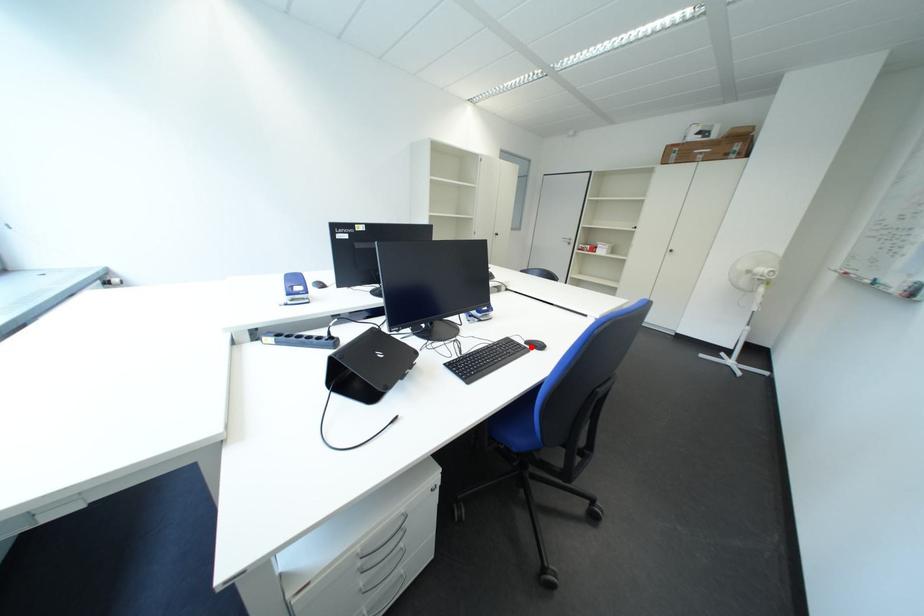
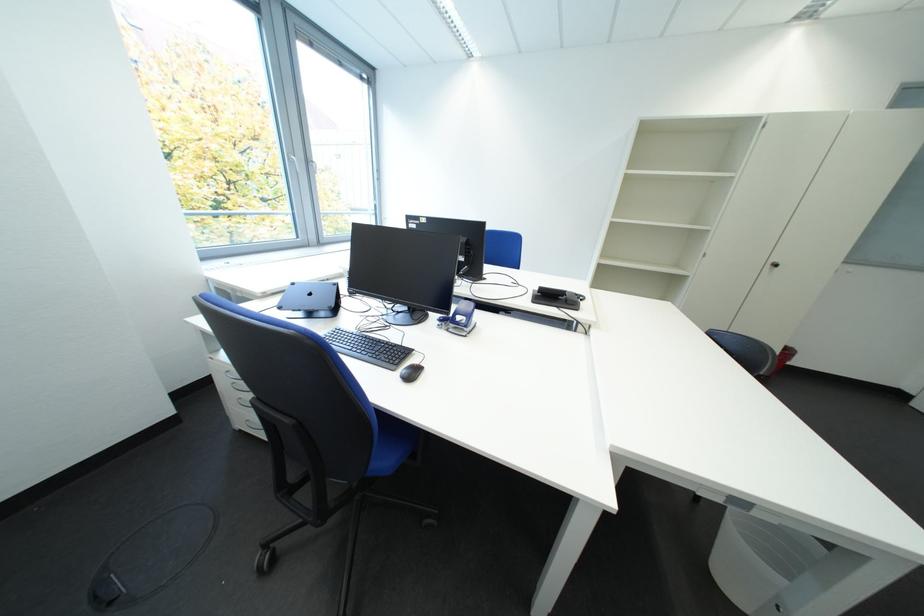
The point at the highlighted location is marked in the first image. Where is the corresponding point in the second image?

(412, 361)